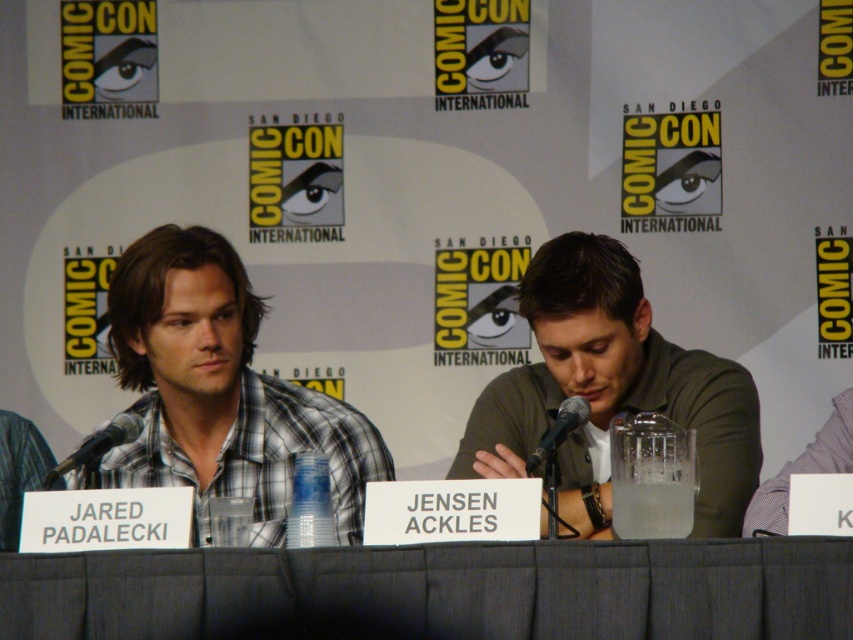
You are attending Comic Con and want to take a photo of the gray fabric table at center and the black metallic microphone at center. Which object will appear larger in your photo?

The gray fabric table at center will appear larger in your photo because it is closer to the viewer than the black metallic microphone at center.

You are organizing a small panel discussion and need to place a gray fabric table at center and a black metallic microphone at left on a stage. Given that the stage has limited space, can you determine which object requires more horizontal space based on their widths?

The gray fabric table at center has a greater width than the black metallic microphone at left, so it requires more horizontal space.

In the scene shown: You are an event organizer setting up for a panel discussion. You have a gray fabric table at center and a black metallic microphone at center. Where should you place the microphone so it is correctly positioned for the speakers?

The black metallic microphone at center should be placed above the gray fabric table at center to ensure proper positioning for the speakers.